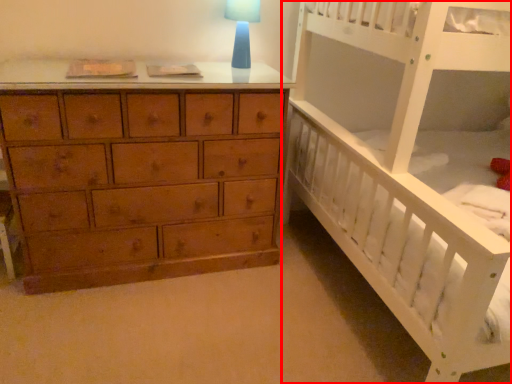
Question: Observing the image, what is the correct spatial positioning of infant bed (annotated by the red box) in reference to table lamp?

Choices:
 (A) left
 (B) right

Answer: (B)